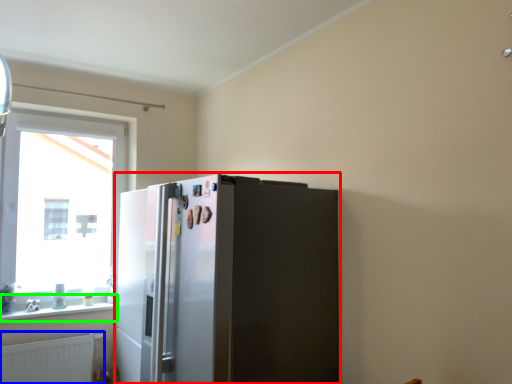
Question: Estimate the real-world distances between objects in this image. Which object is closer to refrigerator (highlighted by a red box), radiator (highlighted by a blue box) or window sill (highlighted by a green box)?

Choices:
 (A) radiator
 (B) window sill

Answer: (A)